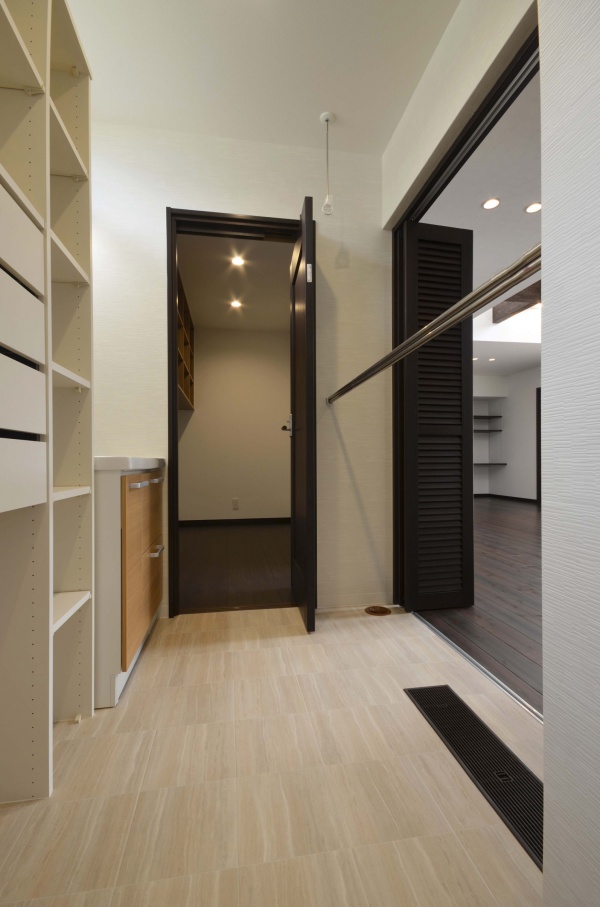
Where is `light wood floor`? Image resolution: width=600 pixels, height=907 pixels. light wood floor is located at coordinates (333, 791).